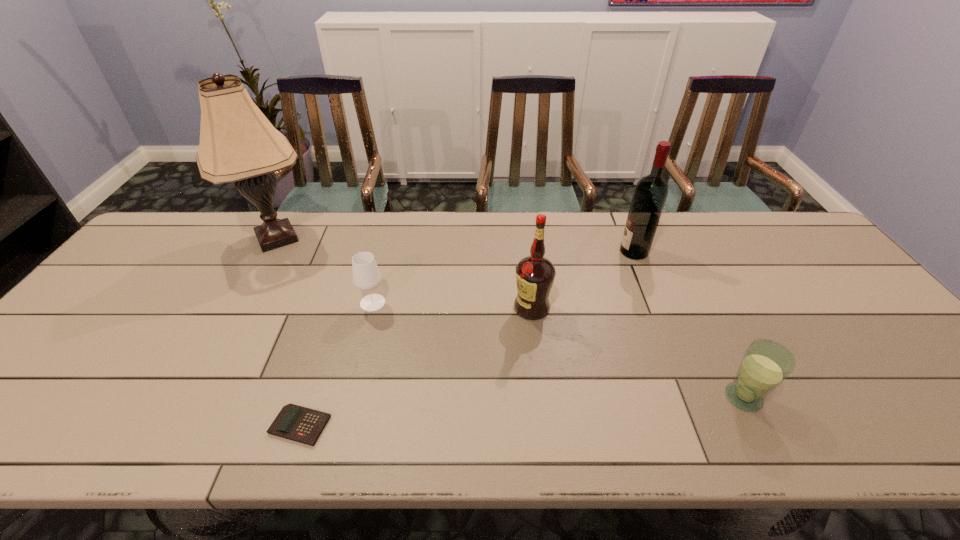
You are a GUI agent. You are given a task and a screenshot of the screen. Output one action in this format:
    pyautogui.click(x=<x>, y=<y>)
    Task: Click on the vacant space located 0.240m on the front of the leftmost object
    The height and width of the screenshot is (540, 960).
    Given the screenshot: What is the action you would take?
    pyautogui.click(x=225, y=331)

Locate an element on the screen. blank space located 0.120m on the front and back of the farther alcohol is located at coordinates (581, 252).

Identify the location of vacant region located on the front and back of the farther alcohol. (597, 252).

The width and height of the screenshot is (960, 540). Identify the location of free space located 0.050m on the front and back of the farther alcohol. (603, 252).

You are a GUI agent. You are given a task and a screenshot of the screen. Output one action in this format:
    pyautogui.click(x=<x>, y=<y>)
    Task: Click on the vacant region located on the label of the left alcohol
    The width and height of the screenshot is (960, 540).
    Given the screenshot: What is the action you would take?
    pyautogui.click(x=400, y=308)

Locate an element on the screen. vacant space located 0.330m on the label of the left alcohol is located at coordinates pos(389,308).

In order to click on vacant space located 0.240m on the label of the left alcohol in this screenshot , I will do tap(423, 308).

You are a GUI agent. You are given a task and a screenshot of the screen. Output one action in this format:
    pyautogui.click(x=<x>, y=<y>)
    Task: Click on the vacant space located 0.320m on the front of the left glass
    The width and height of the screenshot is (960, 540).
    Given the screenshot: What is the action you would take?
    pyautogui.click(x=342, y=423)

The height and width of the screenshot is (540, 960). Identify the location of free point located on the right of the nearer glass. (786, 397).

Identify the location of blank space located on the right of the calculator. This screenshot has height=540, width=960. (464, 426).